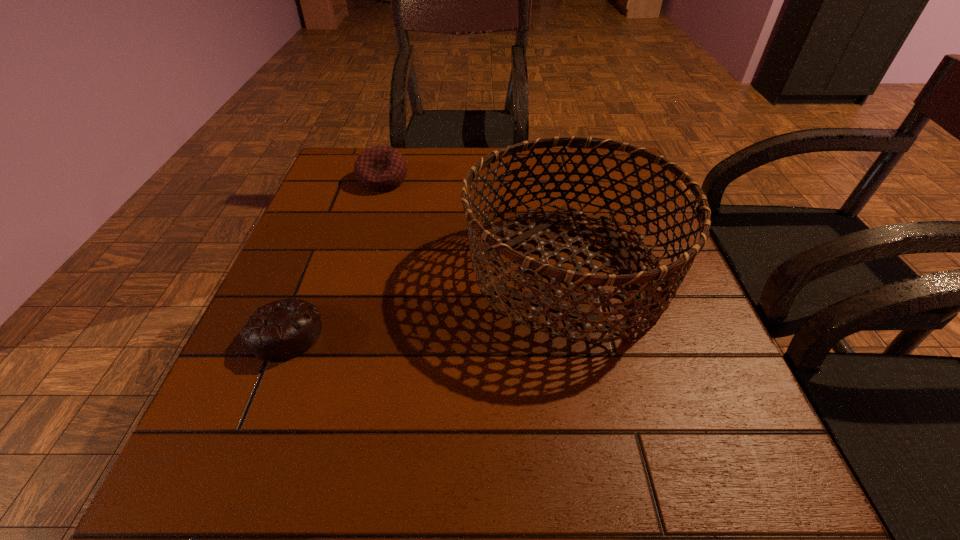
Locate an element on the screen. The image size is (960, 540). object located at the right edge is located at coordinates (594, 283).

Identify the location of object at the far left corner. (380, 168).

The image size is (960, 540). What are the coordinates of `free space at the far edge of the desktop` in the screenshot? It's located at (452, 194).

Locate an element on the screen. The image size is (960, 540). free region at the near edge of the desktop is located at coordinates (647, 522).

At what (x,y) coordinates should I click in order to perform the action: click on vacant space at the right edge. Please return your answer as a coordinate pair (x, y). The image size is (960, 540). Looking at the image, I should click on (660, 249).

Image resolution: width=960 pixels, height=540 pixels. I want to click on vacant space at the far right corner of the desktop, so click(x=598, y=149).

This screenshot has width=960, height=540. Identify the location of blank region between the shortest object and the farther beanbag. (334, 256).

The width and height of the screenshot is (960, 540). Identify the location of blank region between the shortest object and the rightmost object. (427, 301).

Image resolution: width=960 pixels, height=540 pixels. What are the coordinates of `free spot between the shorter beanbag and the rightmost object` in the screenshot? It's located at (427, 301).

Where is `free point between the second shortest object and the shortest object`? Image resolution: width=960 pixels, height=540 pixels. free point between the second shortest object and the shortest object is located at coordinates (334, 256).